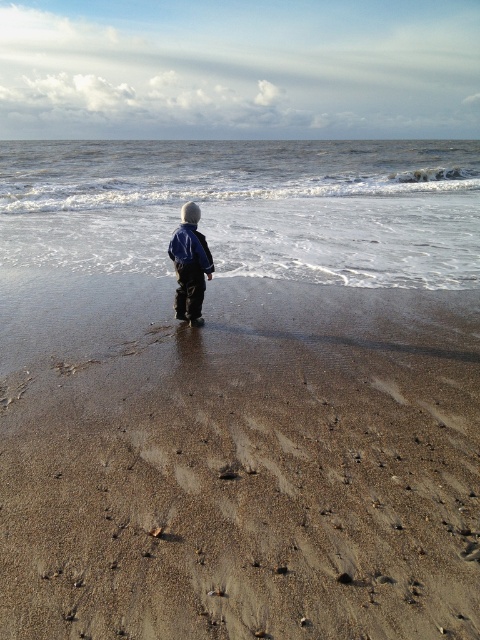
You are a photographer trying to capture the blue denim jacket at center and the white frothy water at center in the same frame. Based on their positions, which object should you adjust your camera to focus on first if you want to include both in your shot?

The white frothy water at center is positioned on the right side of blue denim jacket at center, so you should focus on the blue denim jacket at center first to ensure both objects are included in the frame.

You are a photographer trying to capture the blue denim jacket at center and the brown sandy beach at center in a single shot. Based on their positions, which object should you focus on first to ensure both are in clear view?

The blue denim jacket at center should be focused on first because it is positioned above the brown sandy beach at center, so adjusting focus starting from the higher object ensures both are in clear view.